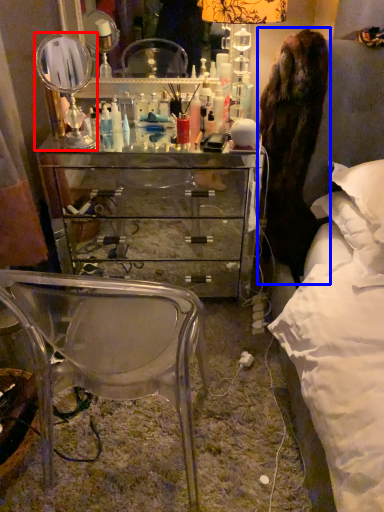
Question: Which point is closer to the camera, mirror (highlighted by a red box) or fur coat (highlighted by a blue box)?

Choices:
 (A) mirror
 (B) fur coat

Answer: (B)